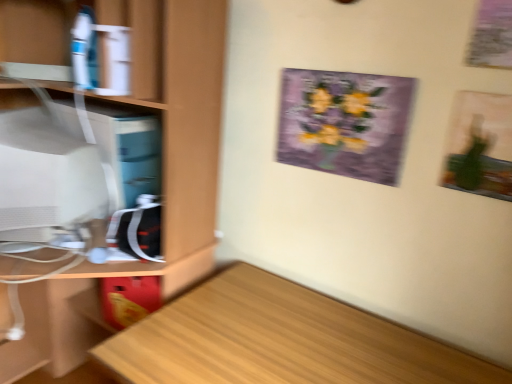
Question: Does wooden cabinet at left lie in front of matte white monitor at left?

Choices:
 (A) yes
 (B) no

Answer: (A)

Question: Is wooden cabinet at left bigger than matte white monitor at left?

Choices:
 (A) yes
 (B) no

Answer: (A)

Question: From the image's perspective, does wooden cabinet at left appear higher than matte white monitor at left?

Choices:
 (A) yes
 (B) no

Answer: (B)

Question: Is wooden cabinet at left positioned beyond the bounds of matte white monitor at left?

Choices:
 (A) yes
 (B) no

Answer: (A)

Question: From the image's perspective, is wooden cabinet at left beneath matte white monitor at left?

Choices:
 (A) yes
 (B) no

Answer: (A)

Question: Does wooden cabinet at left have a smaller size compared to matte white monitor at left?

Choices:
 (A) yes
 (B) no

Answer: (B)

Question: Does wooden cabinet at left have a lesser width compared to purple paper picture frame at upper center?

Choices:
 (A) yes
 (B) no

Answer: (B)

Question: Is wooden cabinet at left positioned far away from purple paper picture frame at upper center?

Choices:
 (A) yes
 (B) no

Answer: (B)

Question: Can you confirm if wooden cabinet at left is shorter than purple paper picture frame at upper center?

Choices:
 (A) no
 (B) yes

Answer: (A)

Question: Is wooden cabinet at left with purple paper picture frame at upper center?

Choices:
 (A) no
 (B) yes

Answer: (A)

Question: Is wooden cabinet at left located outside purple paper picture frame at upper center?

Choices:
 (A) yes
 (B) no

Answer: (A)

Question: Does wooden cabinet at left have a greater width compared to purple paper picture frame at upper center?

Choices:
 (A) no
 (B) yes

Answer: (B)

Question: Can you confirm if purple paper picture frame at upper center is thinner than light wood desk at lower left?

Choices:
 (A) no
 (B) yes

Answer: (B)